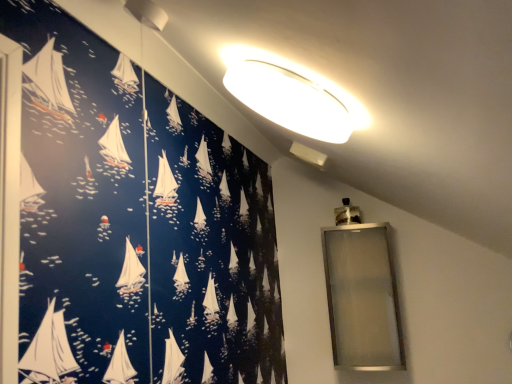
What do you see at coordinates (362, 298) in the screenshot? The width and height of the screenshot is (512, 384). I see `satin silver mirror at right` at bounding box center [362, 298].

Image resolution: width=512 pixels, height=384 pixels. Find the location of `satin silver mirror at right`. satin silver mirror at right is located at coordinates (362, 298).

Where is `satin silver mirror at right`? The height and width of the screenshot is (384, 512). satin silver mirror at right is located at coordinates (362, 298).